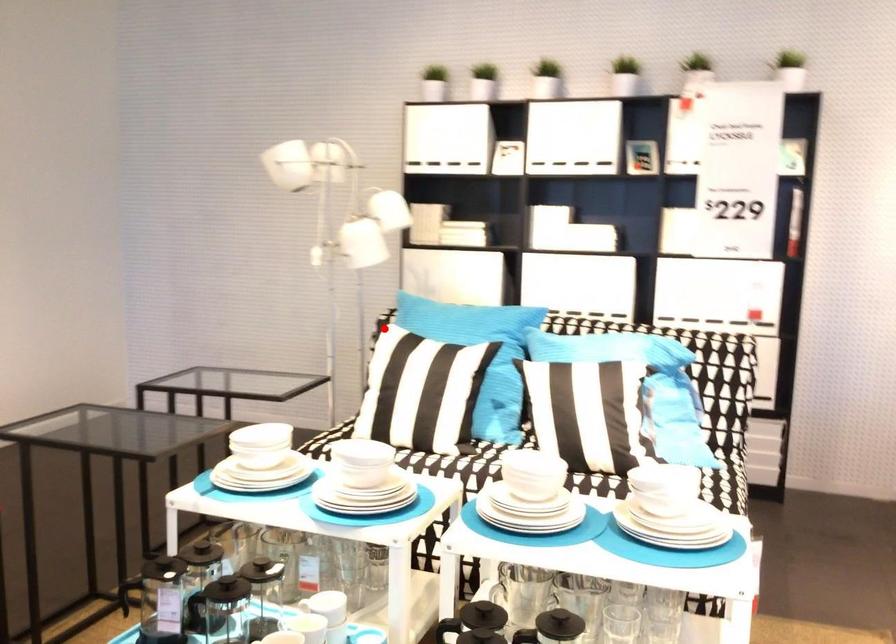
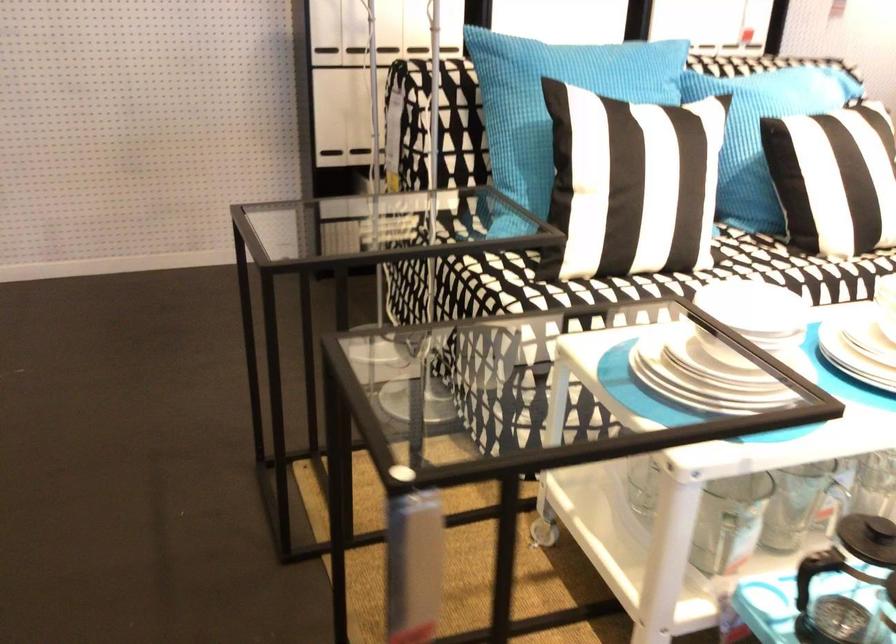
Question: I am providing you with two images of the same scene from different viewpoints. A red point is shown in image1. For the corresponding object point in image2, is it positioned nearer or farther from the camera?

Choices:
 (A) Nearer
 (B) Farther

Answer: (A)